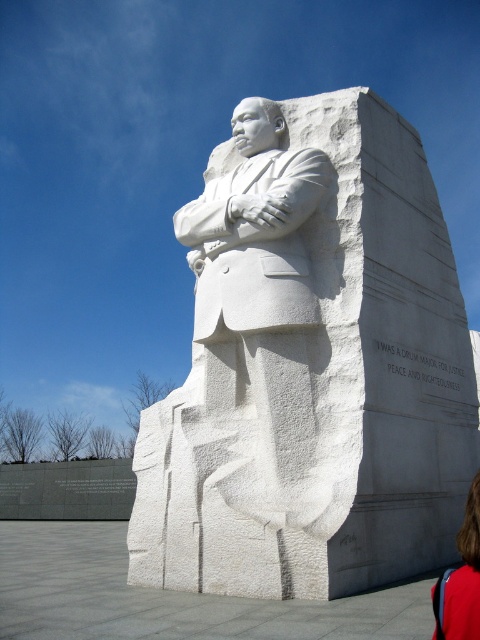
You are a tour guide explaining the Martin Luther King Jr. memorial to a group. You point out the white marble statue at center and the blonde hair at lower right. Which object is located to the left of the other?

The white marble statue at center is positioned on the left side of blonde hair at lower right.

You are standing in front of the Martin Luther King Jr. statue and want to touch both points on the monument. Which point should you reach for first, point [395,212] or point [446,634]?

You should reach for point [395,212] first because it is closer to you than point [446,634].

You are standing at the entrance of the memorial and want to locate the white marble statue at center. What are the coordinates where you can find it?

The white marble statue at center can be found at coordinates point (311, 365).